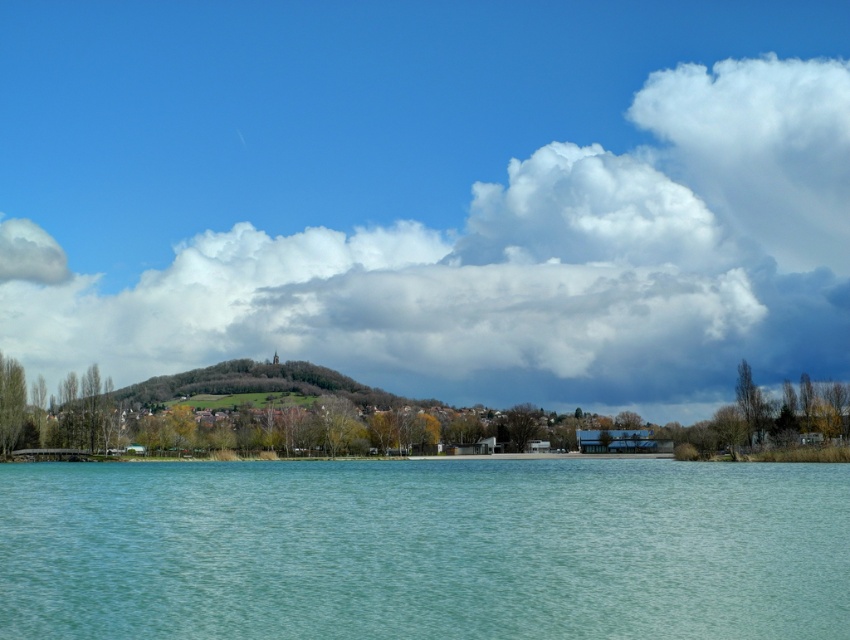
Is point (496, 340) farther from camera compared to point (694, 624)?

Yes, point (496, 340) is farther from viewer.

Which is more to the right, white fluffy cloud at upper center or clear water at center?

From the viewer's perspective, clear water at center appears more on the right side.

Between point (32, 326) and point (731, 472), which one is positioned behind?

The point (32, 326) is more distant.

Locate an element on the screen. The width and height of the screenshot is (850, 640). white fluffy cloud at upper center is located at coordinates (520, 266).